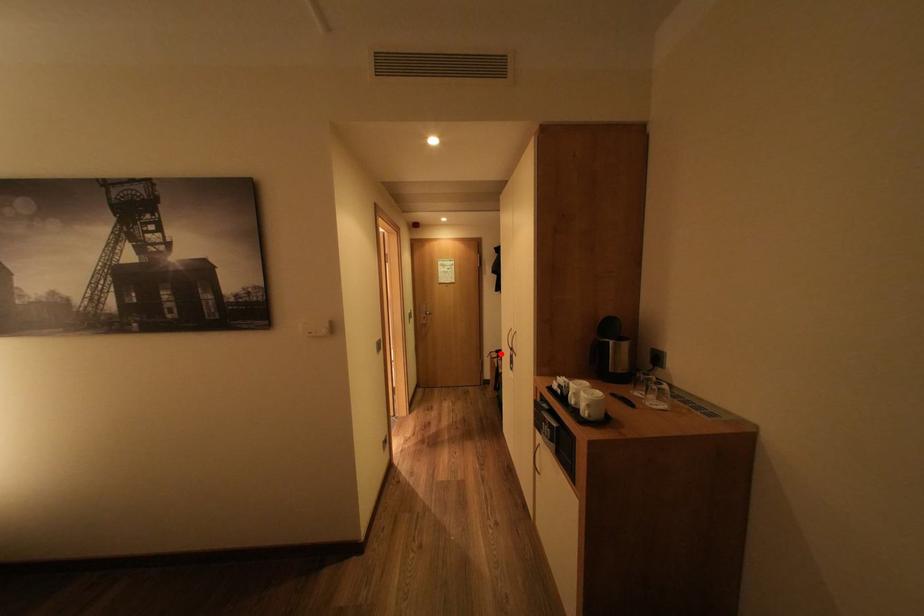
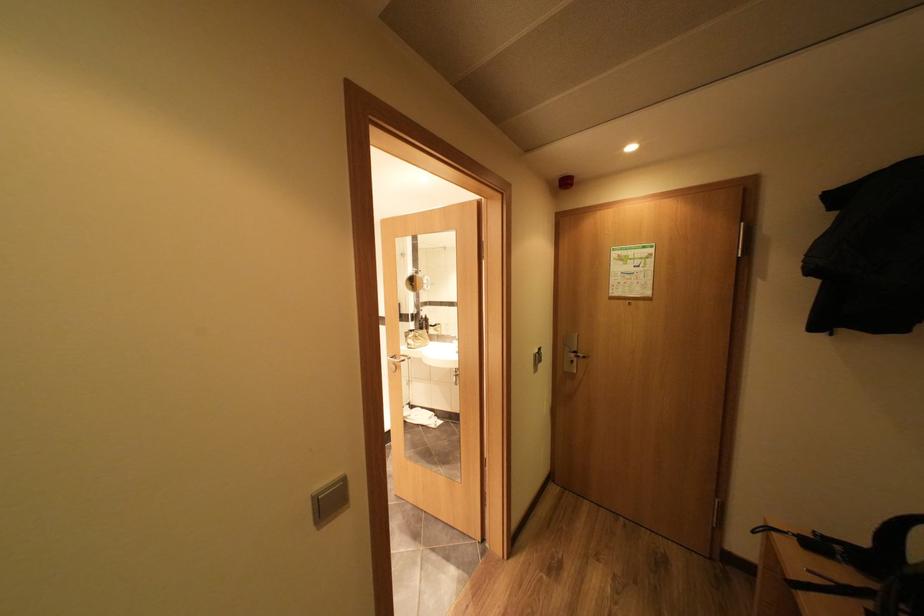
Locate, in the second image, the point that corresponds to the highlighted location in the first image.

(779, 529)